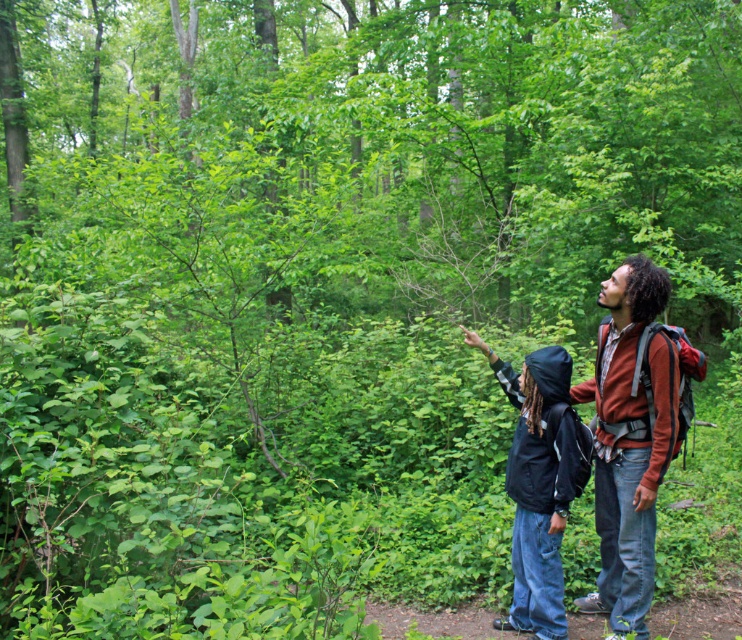
Question: Which object is farther from the camera taking this photo?

Choices:
 (A) black jacket at right
 (B) brown cotton shirt at right

Answer: (A)

Question: Does brown cotton shirt at right appear over black jacket at right?

Choices:
 (A) yes
 (B) no

Answer: (A)

Question: Can you confirm if brown cotton shirt at right is smaller than black jacket at right?

Choices:
 (A) yes
 (B) no

Answer: (B)

Question: Among these points, which one is farthest from the camera?

Choices:
 (A) (620, 488)
 (B) (518, 616)

Answer: (B)

Question: Does brown cotton shirt at right appear over black jacket at right?

Choices:
 (A) no
 (B) yes

Answer: (B)